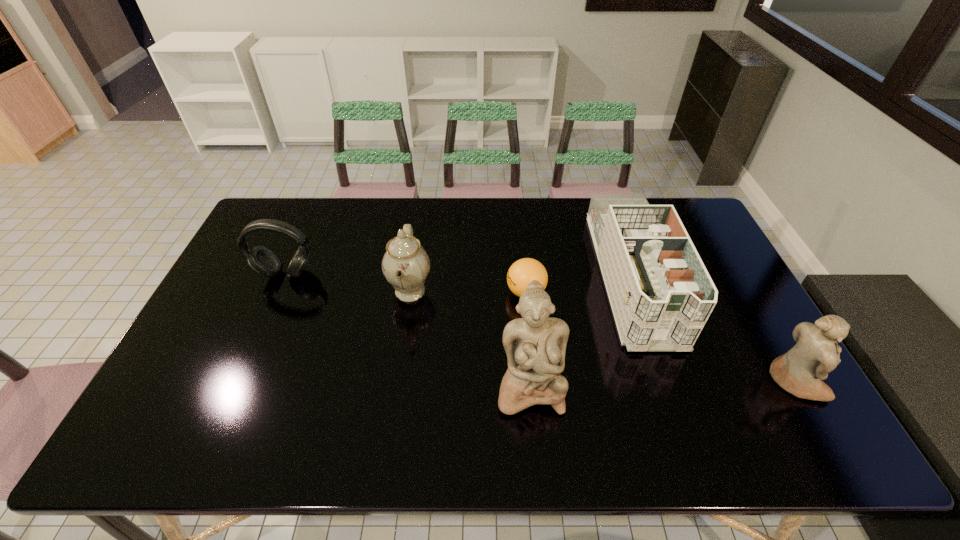
This screenshot has height=540, width=960. I want to click on the left figurine, so click(x=535, y=345).

The height and width of the screenshot is (540, 960). I want to click on the tallest object, so (x=535, y=345).

Where is `the right figurine`? The image size is (960, 540). the right figurine is located at coordinates (800, 371).

At what (x,y) coordinates should I click in order to perform the action: click on the rightmost object. Please return your answer as a coordinate pair (x, y). The image size is (960, 540). Looking at the image, I should click on (800, 371).

Find the location of a particular element. the fifth object from left to right is located at coordinates (661, 294).

Find the location of a particular element. Image resolution: width=960 pixels, height=540 pixels. headset is located at coordinates (261, 260).

Identify the location of chinaware. The image size is (960, 540). (406, 265).

Find the location of a particular element. The image size is (960, 540). the shortest object is located at coordinates (523, 271).

Find the location of a particular element. The height and width of the screenshot is (540, 960). free space located at the entrance of the dollhouse is located at coordinates (673, 400).

Locate an element on the screen. blank space located 0.270m on the earcups of the leftmost object is located at coordinates (250, 355).